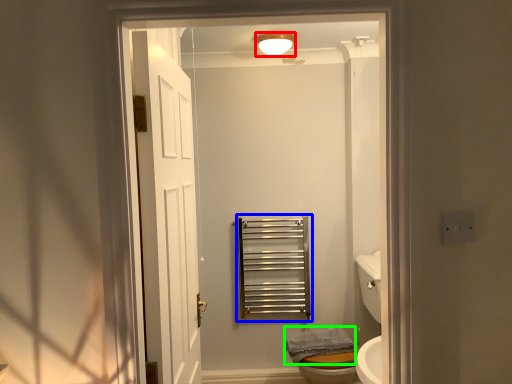
Question: Which is nearer to the light fixture (highlighted by a red box)? balustrade (highlighted by a blue box) or bath towel (highlighted by a green box).

Choices:
 (A) balustrade
 (B) bath towel

Answer: (A)